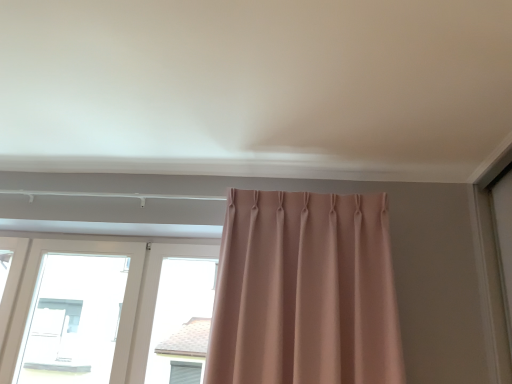
The width and height of the screenshot is (512, 384). Describe the element at coordinates (122, 303) in the screenshot. I see `white plastic window at left` at that location.

What are the coordinates of `white plastic window at left` in the screenshot? It's located at (122, 303).

Where is `matte pink curtain at center`? The height and width of the screenshot is (384, 512). matte pink curtain at center is located at coordinates (304, 291).

Describe the element at coordinates (304, 291) in the screenshot. I see `matte pink curtain at center` at that location.

I want to click on white plastic window at left, so click(x=122, y=303).

In the image, is matte pink curtain at center on the left side or the right side of white plastic window at left?

matte pink curtain at center is to the right of white plastic window at left.

Considering the positions of objects matte pink curtain at center and white plastic window at left in the image provided, who is behind, matte pink curtain at center or white plastic window at left?

white plastic window at left is more distant.

Considering the positions of point (342, 375) and point (139, 350), is point (342, 375) closer or farther from the camera than point (139, 350)?

Point (342, 375) is closer to the camera than point (139, 350).

From the image's perspective, is matte pink curtain at center on top of white plastic window at left?

Indeed, from the image's perspective, matte pink curtain at center is shown above white plastic window at left.

From a real-world perspective, is matte pink curtain at center positioned above or below white plastic window at left?

matte pink curtain at center is above white plastic window at left.

Between matte pink curtain at center and white plastic window at left, which one has smaller width?

Thinner between the two is matte pink curtain at center.

Can you confirm if matte pink curtain at center is taller than white plastic window at left?

Yes.

Considering the sizes of matte pink curtain at center and white plastic window at left in the image, is matte pink curtain at center bigger or smaller than white plastic window at left?

In the image, matte pink curtain at center appears to be smaller than white plastic window at left.

Choose the correct answer: Is matte pink curtain at center inside white plastic window at left or outside it?

matte pink curtain at center is not enclosed by white plastic window at left.

Is matte pink curtain at center not close to white plastic window at left?

No.

Is matte pink curtain at center positioned with its back to white plastic window at left?

No, matte pink curtain at center is not facing the opposite direction of white plastic window at left.

Identify the location of curtain on the right of the white plastic window at left. The height and width of the screenshot is (384, 512). (304, 291).

Which is more to the left, white plastic window at left or matte pink curtain at center?

Positioned to the left is white plastic window at left.

Is the depth of white plastic window at left less than that of matte pink curtain at center?

No, white plastic window at left is further to the viewer.

Looking at this image, which point is more forward, [140,268] or [288,379]?

The point [288,379] is closer.

Consider the image. From the image's perspective, is white plastic window at left below matte pink curtain at center?

Yes, from the image's perspective, white plastic window at left is below matte pink curtain at center.

From a real-world perspective, is white plastic window at left physically below matte pink curtain at center?

Yes.

Considering the relative sizes of white plastic window at left and matte pink curtain at center in the image provided, is white plastic window at left wider than matte pink curtain at center?

Yes.

Between white plastic window at left and matte pink curtain at center, which one has less height?

white plastic window at left is shorter.

Considering the sizes of objects white plastic window at left and matte pink curtain at center in the image provided, who is smaller, white plastic window at left or matte pink curtain at center?

With smaller size is matte pink curtain at center.

Is matte pink curtain at center located within white plastic window at left?

No, matte pink curtain at center is not surrounded by white plastic window at left.

Is white plastic window at left next to matte pink curtain at center and touching it?

No.

Is white plastic window at left turned away from matte pink curtain at center?

No, white plastic window at left is not facing the opposite direction of matte pink curtain at center.

What's the angular difference between white plastic window at left and matte pink curtain at center's facing directions?

The angular difference between white plastic window at left and matte pink curtain at center is 0.873 degrees.

The height and width of the screenshot is (384, 512). I want to click on curtain located above the white plastic window at left (from a real-world perspective), so click(x=304, y=291).

Locate an element on the screen. The image size is (512, 384). curtain positioned vertically above the white plastic window at left (from a real-world perspective) is located at coordinates (304, 291).

Locate an element on the screen. window that is under the matte pink curtain at center (from a real-world perspective) is located at coordinates (122, 303).